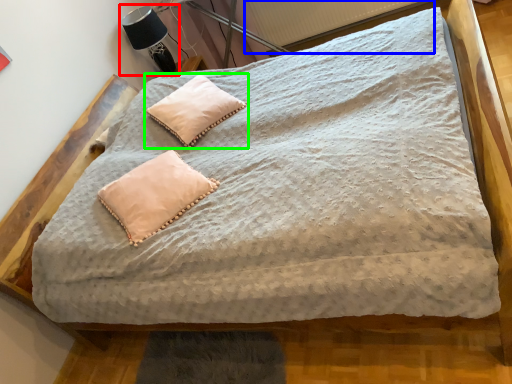
Question: Which object is the closest to the table lamp (highlighted by a red box)? Choose among these: radiator (highlighted by a blue box) or pillow (highlighted by a green box).

Choices:
 (A) radiator
 (B) pillow

Answer: (B)